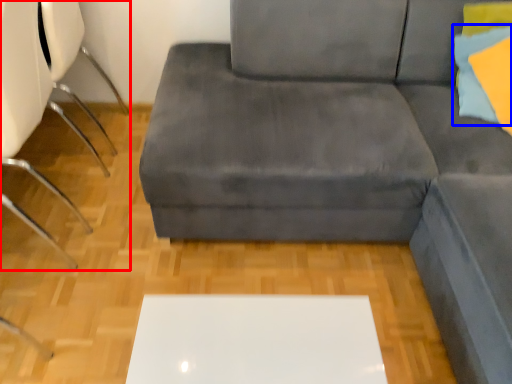
Question: Which point is further to the camera, chair (highlighted by a red box) or pillow (highlighted by a blue box)?

Choices:
 (A) chair
 (B) pillow

Answer: (B)